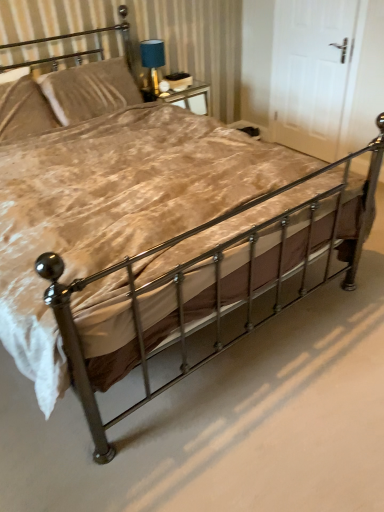
Question: Is polished metal bed frame at center completely or partially inside velvet-like beige pillow at upper left, acting as the first pillow starting from the right?

Choices:
 (A) yes
 (B) no

Answer: (B)

Question: Is velvet-like beige pillow at upper left, acting as the first pillow starting from the right, completely or partially outside of polished metal bed frame at center?

Choices:
 (A) no
 (B) yes

Answer: (B)

Question: Is the position of velvet-like beige pillow at upper left, the second pillow from the left, less distant than that of polished metal bed frame at center?

Choices:
 (A) yes
 (B) no

Answer: (B)

Question: Are velvet-like beige pillow at upper left, acting as the first pillow starting from the right, and polished metal bed frame at center making contact?

Choices:
 (A) yes
 (B) no

Answer: (B)

Question: From the image's perspective, is velvet-like beige pillow at upper left, acting as the first pillow starting from the right, on top of polished metal bed frame at center?

Choices:
 (A) no
 (B) yes

Answer: (B)

Question: From a real-world perspective, does velvet-like beige pillow at upper left, acting as the first pillow starting from the right, stand above polished metal bed frame at center?

Choices:
 (A) no
 (B) yes

Answer: (B)

Question: Would you say polished metal bed frame at center is outside blue fabric lampshade at upper center?

Choices:
 (A) no
 (B) yes

Answer: (B)

Question: Is polished metal bed frame at center in front of blue fabric lampshade at upper center?

Choices:
 (A) no
 (B) yes

Answer: (B)

Question: From the image's perspective, is polished metal bed frame at center under blue fabric lampshade at upper center?

Choices:
 (A) yes
 (B) no

Answer: (A)

Question: From the image's perspective, is polished metal bed frame at center on top of blue fabric lampshade at upper center?

Choices:
 (A) yes
 (B) no

Answer: (B)

Question: Could you tell me if polished metal bed frame at center is turned towards blue fabric lampshade at upper center?

Choices:
 (A) no
 (B) yes

Answer: (A)

Question: Can you confirm if polished metal bed frame at center is smaller than blue fabric lampshade at upper center?

Choices:
 (A) no
 (B) yes

Answer: (A)

Question: Is velvet beige pillow at upper left, marked as the first pillow in a left-to-right arrangement, positioned beyond the bounds of white matte door at upper right?

Choices:
 (A) no
 (B) yes

Answer: (B)